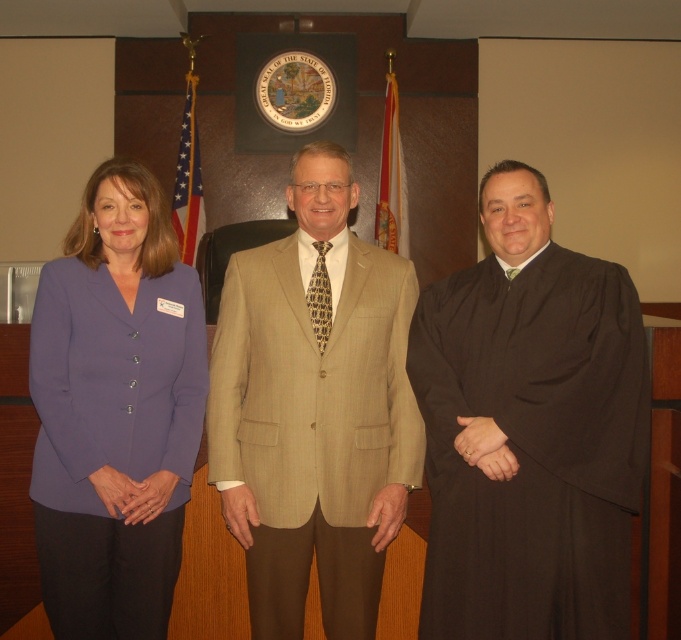
Can you confirm if black matte robe at right is smaller than tan pinstripe suit at center?

Incorrect, black matte robe at right is not smaller in size than tan pinstripe suit at center.

Can you confirm if black matte robe at right is taller than tan pinstripe suit at center?

No.

Identify the location of black matte robe at right. This screenshot has height=640, width=681. (528, 429).

Is tan pinstripe suit at center shorter than purple fabric blazer at left?

No, tan pinstripe suit at center is not shorter than purple fabric blazer at left.

Is the position of tan pinstripe suit at center less distant than that of purple fabric blazer at left?

No.

The width and height of the screenshot is (681, 640). In order to click on tan pinstripe suit at center in this screenshot , I will do `click(315, 408)`.

The height and width of the screenshot is (640, 681). What are the coordinates of `tan pinstripe suit at center` in the screenshot? It's located at (315, 408).

Is point (620, 618) positioned after point (86, 268)?

No.

Which is below, black matte robe at right or purple fabric blazer at left?

purple fabric blazer at left is below.

What are the coordinates of `black matte robe at right` in the screenshot? It's located at (528, 429).